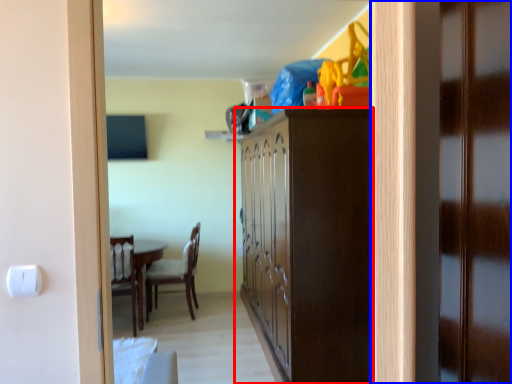
Question: Which point is further to the camera, cabinetry (highlighted by a red box) or door (highlighted by a blue box)?

Choices:
 (A) cabinetry
 (B) door

Answer: (A)